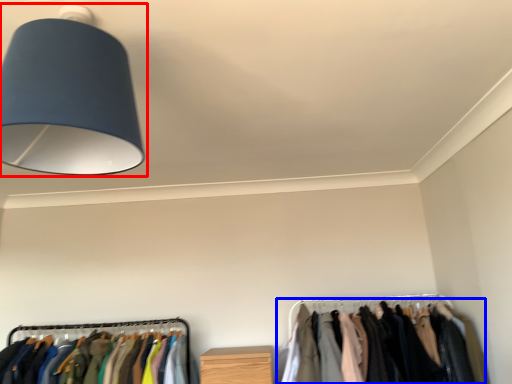
Question: Which object appears farthest to the camera in this image, lamp (highlighted by a red box) or closet (highlighted by a blue box)?

Choices:
 (A) lamp
 (B) closet

Answer: (B)